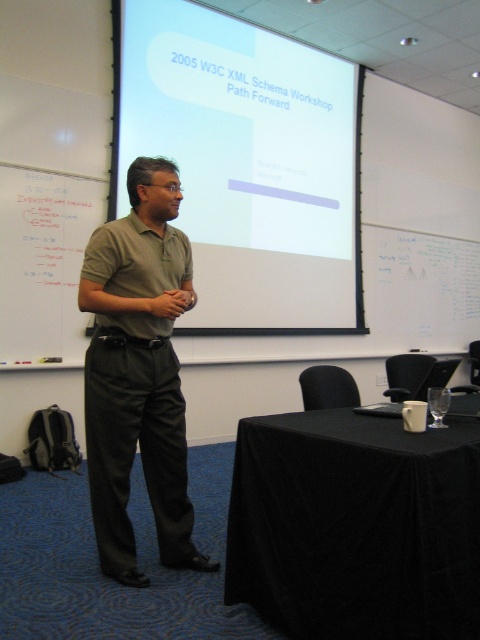
Consider the image. Is white matte projection screen at upper center closer to the viewer compared to matte khaki polo shirt at center?

No, it is behind matte khaki polo shirt at center.

Between point (301, 227) and point (149, 394), which one is positioned in front?

Point (149, 394) is more forward.

Image resolution: width=480 pixels, height=640 pixels. Find the location of `white matte projection screen at upper center`. white matte projection screen at upper center is located at coordinates pos(245,161).

What do you see at coordinates (356, 525) in the screenshot?
I see `black clothed table at lower right` at bounding box center [356, 525].

Does point (335, 445) come closer to viewer compared to point (58, 330)?

Yes, it is.

Locate an element on the screen. The image size is (480, 640). black clothed table at lower right is located at coordinates point(356,525).

Is white matte projection screen at upper center smaller than black clothed table at lower right?

Actually, white matte projection screen at upper center might be larger than black clothed table at lower right.

Between point (207, 99) and point (316, 428), which one is positioned behind?

The point (207, 99) is more distant.

Does point (241, 321) come in front of point (288, 538)?

No.

Identify the location of white matte projection screen at upper center. (245, 161).